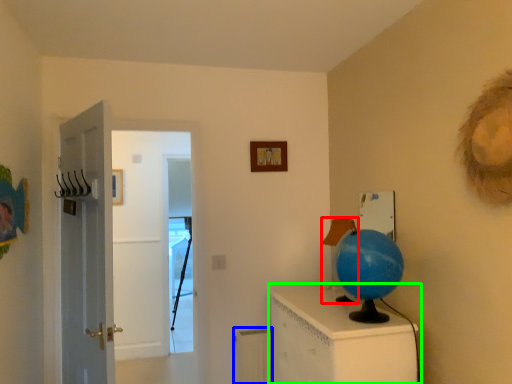
Question: Estimate the real-world distances between objects in this image. Which object is closer to lamp (highlighted by a red box), radiator (highlighted by a blue box) or furniture (highlighted by a green box)?

Choices:
 (A) radiator
 (B) furniture

Answer: (B)